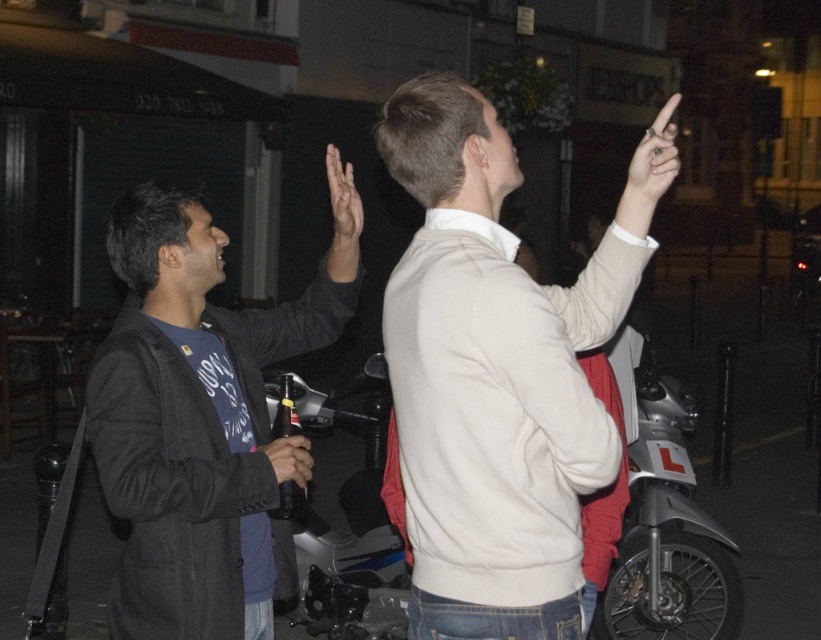
Locate an element on the screen. dark gray jacket at left is located at coordinates (195, 424).

Is dark gray jacket at left behind smooth black hand at center?

That is False.

Between point (99, 474) and point (305, 474), which one is positioned in front?

Positioned in front is point (99, 474).

Where is `dark gray jacket at left`? This screenshot has height=640, width=821. dark gray jacket at left is located at coordinates (195, 424).

Is dark gray jacket at left thinner than silver metallic motorcycle at center?

Indeed, dark gray jacket at left has a lesser width compared to silver metallic motorcycle at center.

Does dark gray jacket at left have a lesser height compared to silver metallic motorcycle at center?

Correct, dark gray jacket at left is not as tall as silver metallic motorcycle at center.

I want to click on dark gray jacket at left, so click(195, 424).

Between point (228, 310) and point (340, 220), which one is positioned behind?

The point (228, 310) is more distant.

Is dark gray jacket at left to the left of matte skin hand at upper center from the viewer's perspective?

No, dark gray jacket at left is not to the left of matte skin hand at upper center.

Between point (202, 323) and point (338, 212), which one is positioned in front?

Point (202, 323) is in front.

At what (x,y) coordinates should I click in order to perform the action: click on dark gray jacket at left. Please return your answer as a coordinate pair (x, y). Image resolution: width=821 pixels, height=640 pixels. Looking at the image, I should click on (195, 424).